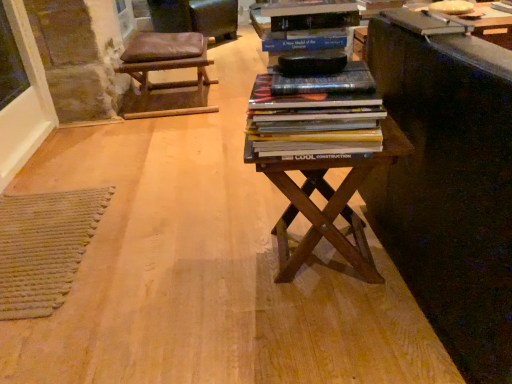
Describe the element at coordinates (305, 26) in the screenshot. I see `black matte bookshelf at upper center` at that location.

You are a GUI agent. You are given a task and a screenshot of the screen. Output one action in this format:
    pyautogui.click(x=<x>, y=<y>)
    Task: Click on the brown wooden table at center
    
    Given the screenshot: What is the action you would take?
    pyautogui.click(x=320, y=148)

Is black matte bookshelf at upper center surrounding brown wooden table at center?

Actually, brown wooden table at center is outside black matte bookshelf at upper center.

Measure the distance from black matte bookshelf at upper center to brown wooden table at center.

black matte bookshelf at upper center and brown wooden table at center are 11.49 inches apart from each other.

Is black matte bookshelf at upper center further to camera compared to brown wooden table at center?

Yes, black matte bookshelf at upper center is behind brown wooden table at center.

Is point (289, 37) farther from viewer compared to point (309, 170)?

No, (289, 37) is in front of (309, 170).

Considering the sizes of objects brown wooden table at center and brown leather stool at upper left in the image provided, who is shorter, brown wooden table at center or brown leather stool at upper left?

brown wooden table at center is shorter.

From a real-world perspective, is brown wooden table at center above or below brown leather stool at upper left?

brown wooden table at center is below brown leather stool at upper left.

From the image's perspective, is brown wooden table at center located above or below brown leather stool at upper left?

Clearly, from the image's perspective, brown wooden table at center is below brown leather stool at upper left.

Is brown wooden table at center to the left of brown leather stool at upper left from the viewer's perspective?

In fact, brown wooden table at center is to the right of brown leather stool at upper left.

Considering the sizes of objects brown wooden table at center and black matte bookshelf at upper center in the image provided, who is smaller, brown wooden table at center or black matte bookshelf at upper center?

black matte bookshelf at upper center.

Who is shorter, brown wooden table at center or black matte bookshelf at upper center?

Standing shorter between the two is black matte bookshelf at upper center.

Between point (285, 252) and point (323, 30), which one is positioned behind?

The point (285, 252) is farther.

Choose the correct answer: Is brown wooden table at center inside black matte bookshelf at upper center or outside it?

brown wooden table at center is located beyond the bounds of black matte bookshelf at upper center.

From the image's perspective, is hardcover books at center above brown leather stool at upper left?

No, from the image's perspective, hardcover books at center is not over brown leather stool at upper left.

Considering the points (338, 125) and (136, 35), which point is behind, point (338, 125) or point (136, 35)?

Positioned behind is point (136, 35).

Could brown leather stool at upper left be considered to be inside hardcover books at center?

That's incorrect, brown leather stool at upper left is not inside hardcover books at center.

Relative to brown leather stool at upper left, is hardcover books at center in front or behind?

Clearly, hardcover books at center is in front of brown leather stool at upper left.

Between brown leather stool at upper left and hardcover books at center, which one is positioned behind?

Positioned behind is brown leather stool at upper left.

Is brown leather stool at upper left inside the boundaries of hardcover books at center, or outside?

brown leather stool at upper left is not enclosed by hardcover books at center.

Is brown wooden table at center surrounded by brown leather stool at upper left?

Actually, brown wooden table at center is outside brown leather stool at upper left.

Considering the sizes of objects brown leather stool at upper left and brown wooden table at center in the image provided, who is smaller, brown leather stool at upper left or brown wooden table at center?

With smaller size is brown wooden table at center.

Looking at their sizes, would you say brown leather stool at upper left is wider or thinner than brown wooden table at center?

brown leather stool at upper left is wider than brown wooden table at center.

Can you confirm if brown leather stool at upper left is taller than brown wooden table at center?

Yes.

From the picture: From a real-world perspective, is brown leather stool at upper left physically below black matte bookshelf at upper center?

Yes, from a real-world perspective, brown leather stool at upper left is beneath black matte bookshelf at upper center.

How far apart are brown leather stool at upper left and black matte bookshelf at upper center?

brown leather stool at upper left and black matte bookshelf at upper center are 2.76 meters apart from each other.

Could you tell me if brown leather stool at upper left is facing black matte bookshelf at upper center?

No.

Find the location of `rocking chair located behind the black matte bookshelf at upper center`. rocking chair located behind the black matte bookshelf at upper center is located at coordinates (196, 17).

Find the location of a particular element. This screenshot has width=512, height=384. table lying in front of the black matte bookshelf at upper center is located at coordinates (320, 148).

Locate an element on the screen. Image resolution: width=512 pixels, height=384 pixels. rocking chair that appears above the brown wooden table at center (from the image's perspective) is located at coordinates (196, 17).

Looking at the image, which one is located closer to hardcover books at center, hardcover book at upper right or black matte bookshelf at upper center?

The object closer to hardcover books at center is black matte bookshelf at upper center.

Looking at this image, which object lies further to the anchor point brown leather stool at upper left, brown leather stool at upper left or brown wooden table at center?

Among the two, brown wooden table at center is located further to brown leather stool at upper left.

Which object lies nearer to the anchor point brown leather stool at upper left, black matte bookshelf at upper center or brown wooden table at center?

The object closer to brown leather stool at upper left is black matte bookshelf at upper center.

Looking at the image, which one is located further to black matte bookshelf at upper center, hardcover books at center or brown leather stool at upper left?

brown leather stool at upper left is positioned further to the anchor black matte bookshelf at upper center.

In the scene shown: Based on their spatial positions, is brown leather stool at upper left or hardcover books at center closer to black matte bookshelf at upper center?

The object closer to black matte bookshelf at upper center is hardcover books at center.

Which object lies nearer to the anchor point brown wooden table at center, brown leather stool at upper left or black matte bookshelf at upper center?

black matte bookshelf at upper center lies closer to brown wooden table at center than the other object.

Based on their spatial positions, is hardcover books at center or hardcover book at upper right further from brown leather stool at upper left?

hardcover books at center is positioned further to the anchor brown leather stool at upper left.

Looking at the image, which one is located closer to black matte bookshelf at upper center, hardcover books at center or brown leather stool at upper left?

Based on the image, hardcover books at center appears to be nearer to black matte bookshelf at upper center.

Find the location of a particular element. The height and width of the screenshot is (384, 512). shelf between hardcover book at upper right and brown leather stool at upper left in the front-back direction is located at coordinates (305, 26).

Locate an element on the screen. The height and width of the screenshot is (384, 512). chair between hardcover book at upper right and brown leather stool at upper left along the z-axis is located at coordinates (166, 69).

The height and width of the screenshot is (384, 512). I want to click on chair located between hardcover books at center and brown leather stool at upper left in the depth direction, so click(x=166, y=69).

Locate an element on the screen. This screenshot has width=512, height=384. table between hardcover book at upper right and brown leather stool at upper left along the z-axis is located at coordinates pyautogui.click(x=320, y=148).